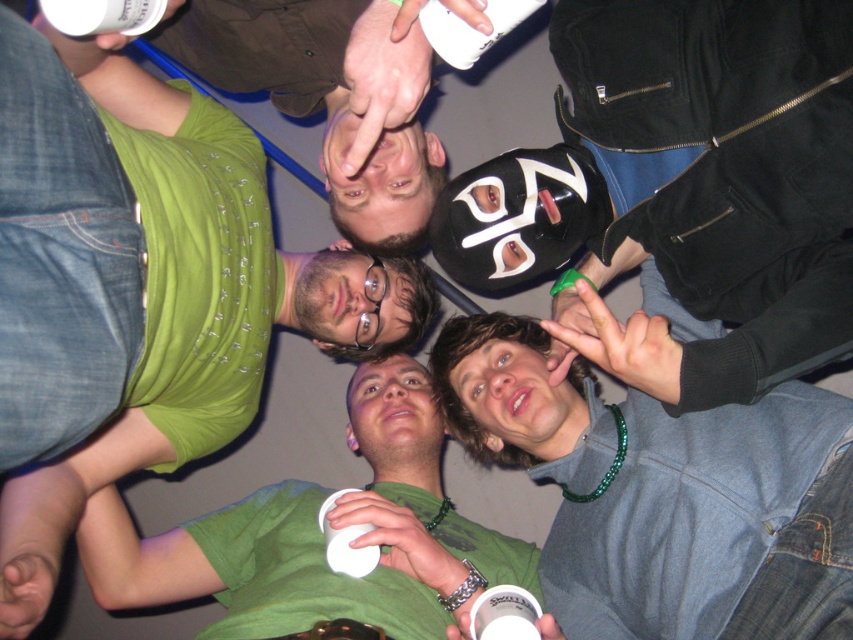
Between point (724, 51) and point (242, 598), which one is positioned in front?

Point (724, 51) is in front.

Locate an element on the screen. This screenshot has width=853, height=640. matte black mask at upper center is located at coordinates (685, 184).

Where is `matte black mask at upper center`? Image resolution: width=853 pixels, height=640 pixels. matte black mask at upper center is located at coordinates (685, 184).

Is matte black mask at upper center to the left of gray-green hoodie at center from the viewer's perspective?

Indeed, matte black mask at upper center is positioned on the left side of gray-green hoodie at center.

Describe the element at coordinates (685, 184) in the screenshot. I see `matte black mask at upper center` at that location.

Image resolution: width=853 pixels, height=640 pixels. Describe the element at coordinates (685, 184) in the screenshot. I see `matte black mask at upper center` at that location.

Identify the location of matte black mask at upper center. coord(685,184).

Can you confirm if gray-green hoodie at center is thinner than green matte shirt at center?

Yes.

Who is positioned more to the left, gray-green hoodie at center or green matte shirt at center?

Positioned to the left is green matte shirt at center.

You are a GUI agent. You are given a task and a screenshot of the screen. Output one action in this format:
    pyautogui.click(x=<x>, y=<y>)
    Task: Click on the gray-green hoodie at center
    
    Given the screenshot: What is the action you would take?
    pyautogui.click(x=663, y=493)